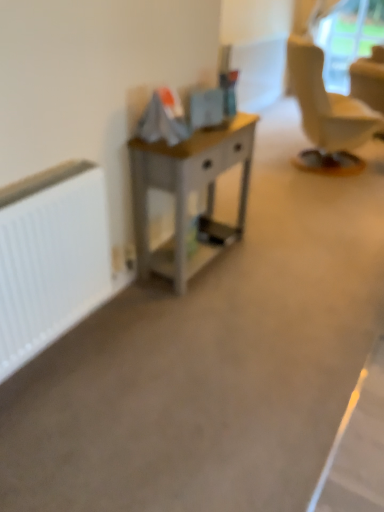
Locate an element on the screen. The image size is (384, 512). vacant area situated below white matte radiator at left (from a real-world perspective) is located at coordinates (62, 342).